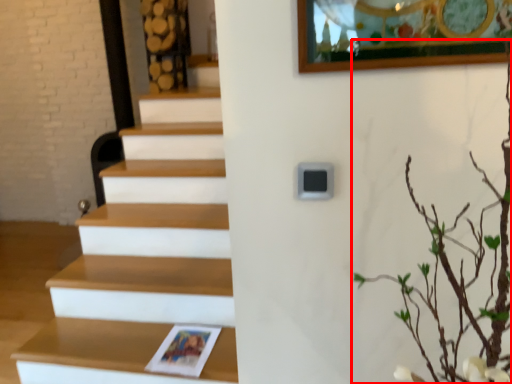
Question: From the image's perspective, where is tree (annotated by the red box) located in relation to shelf in the image?

Choices:
 (A) below
 (B) above

Answer: (B)